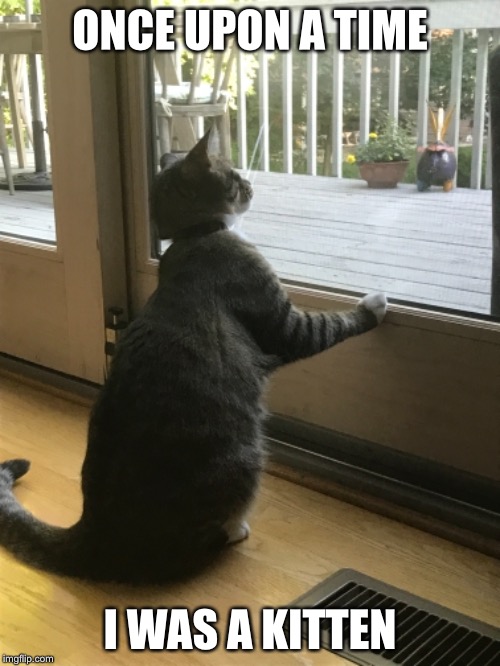
The width and height of the screenshot is (500, 666). Find the location of `chair`. chair is located at coordinates (205, 111).